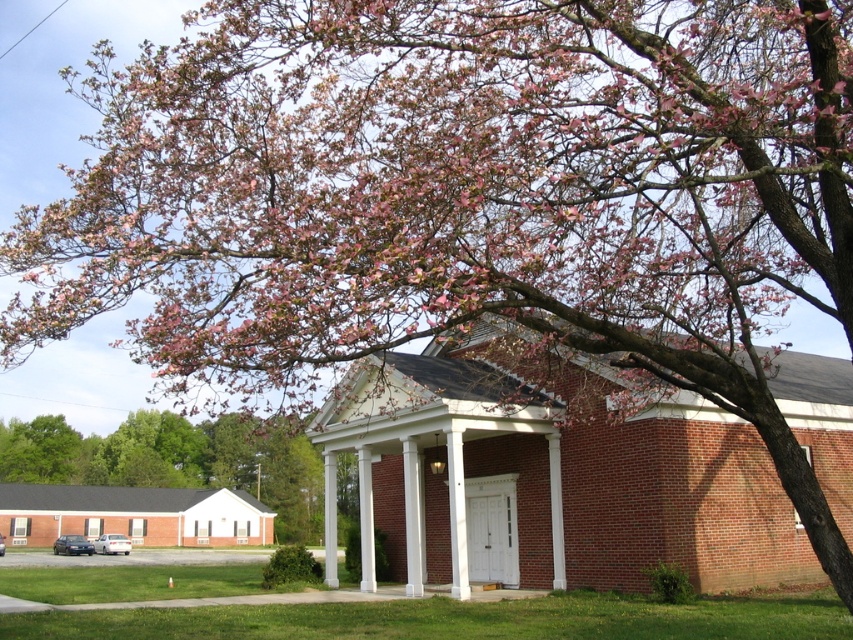
Question: Is pink blossom tree at upper left to the right of white smooth column at center from the viewer's perspective?

Choices:
 (A) yes
 (B) no

Answer: (B)

Question: Which object appears closest to the camera in this image?

Choices:
 (A) pink bloom at upper center
 (B) pink blossom tree at upper left
 (C) white brick porch at center

Answer: (C)

Question: Does pink blossom tree at upper left have a greater width compared to white smooth column at center?

Choices:
 (A) yes
 (B) no

Answer: (A)

Question: Which of the following is the closest to the observer?

Choices:
 (A) (45, 56)
 (B) (366, 472)
 (C) (357, 362)

Answer: (C)

Question: Can you confirm if white brick porch at center is positioned above white smooth column at center?

Choices:
 (A) yes
 (B) no

Answer: (A)

Question: Among these points, which one is nearest to the camera?

Choices:
 (A) (28, 429)
 (B) (469, 362)
 (C) (368, 541)

Answer: (C)